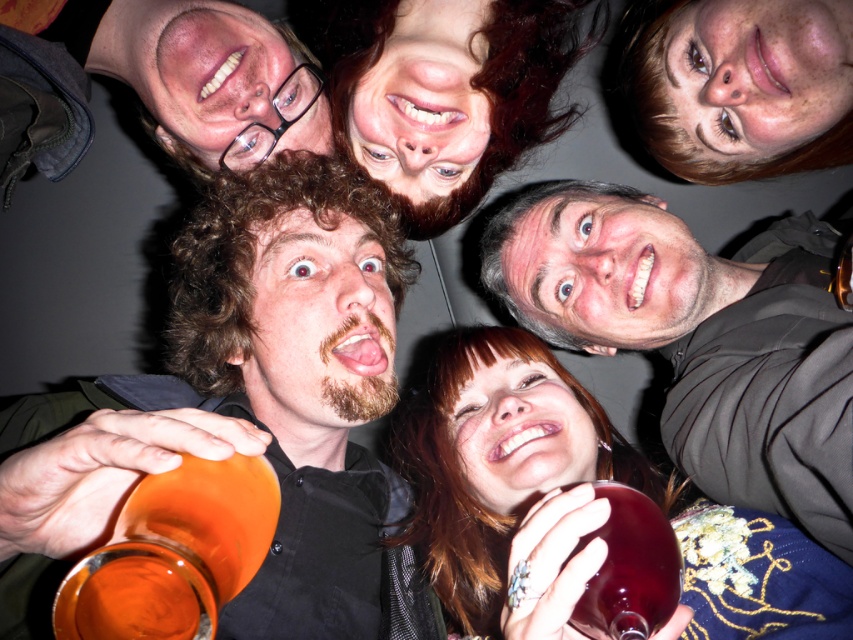
Question: Which object is the closest to the orange glass mug at center?

Choices:
 (A) smooth black shirt at center
 (B) translucent glass wine at center

Answer: (A)

Question: Can you confirm if smooth black shirt at center is positioned to the left of orange glass at lower left?

Choices:
 (A) no
 (B) yes

Answer: (A)

Question: Does smooth black shirt at center have a larger size compared to translucent glass wine at center?

Choices:
 (A) yes
 (B) no

Answer: (A)

Question: Which point is closer to the camera?

Choices:
 (A) (801, 433)
 (B) (654, 547)
 (C) (352, 362)

Answer: (B)

Question: Which point is closer to the camera?

Choices:
 (A) (218, 573)
 (B) (355, 449)
 (C) (813, 513)
 (D) (663, 595)

Answer: (A)

Question: Is orange glass mug at center to the left of translucent glass wine at center from the viewer's perspective?

Choices:
 (A) no
 (B) yes

Answer: (B)